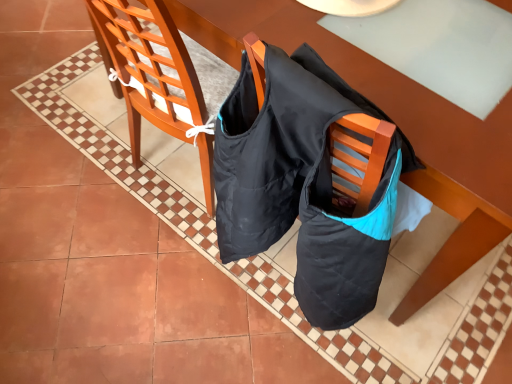
Locate an element on the screen. free spot in front of matte wood chair at left is located at coordinates (145, 254).